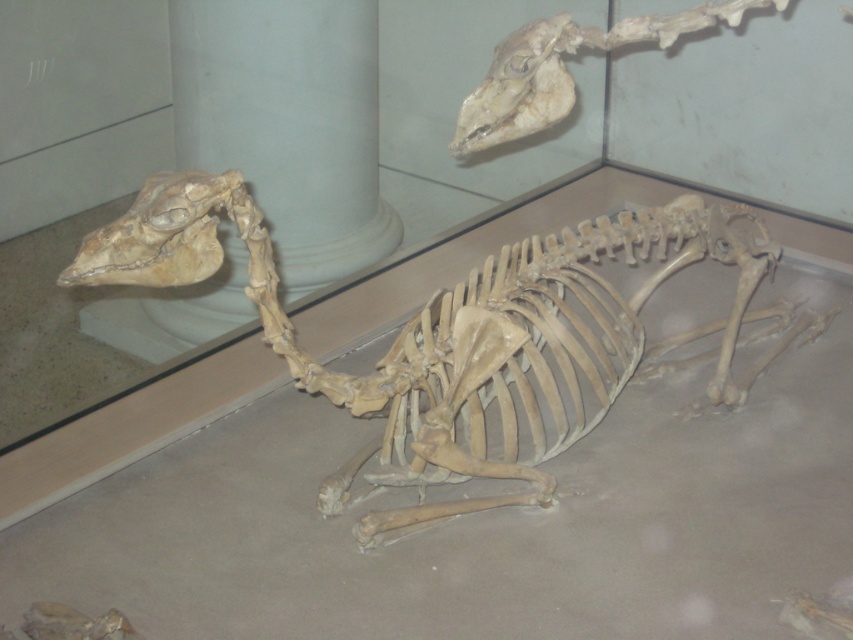
You are a museum visitor standing in front of the display case. You notice the white marble pillar at upper center and the light brown bone at upper center. Which object is closer to the floor?

The white marble pillar at upper center is positioned under the light brown bone at upper center, meaning it is closer to the floor than the bone.

In the scene shown: You are a student examining the mounted skeleton in the museum. You notice a point marked at coordinates (456, 330). What does this point indicate on the skeleton?

The point at coordinates (456, 330) marks the bone in the center of the skeleton.